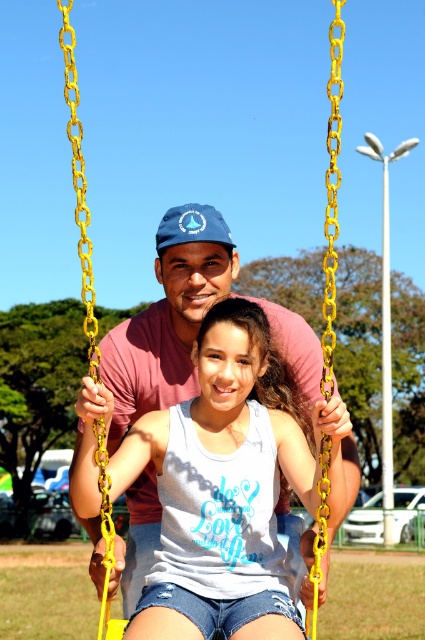
Question: From the image, what is the correct spatial relationship of white cotton tank top at center in relation to blue fabric baseball cap at center?

Choices:
 (A) right
 (B) left

Answer: (A)

Question: Among these points, which one is nearest to the camera?

Choices:
 (A) (240, 376)
 (B) (170, 234)

Answer: (A)

Question: Which of the following is the closest to the observer?

Choices:
 (A) blue fabric baseball cap at center
 (B) white cotton tank top at center

Answer: (B)

Question: Is white cotton tank top at center below blue fabric baseball cap at center?

Choices:
 (A) yes
 (B) no

Answer: (A)

Question: Is white cotton tank top at center positioned before blue fabric baseball cap at center?

Choices:
 (A) yes
 (B) no

Answer: (A)